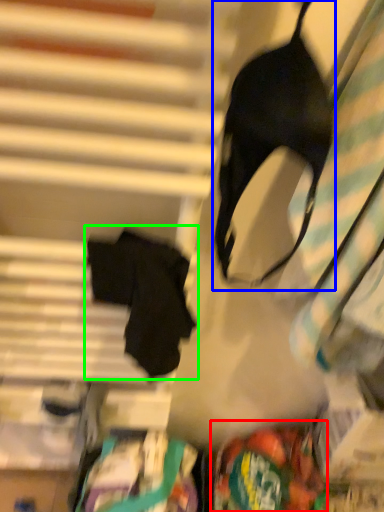
Question: Which is farther away from waste (highlighted by a red box)? brassiere (highlighted by a blue box) or robe (highlighted by a green box)?

Choices:
 (A) brassiere
 (B) robe

Answer: (A)